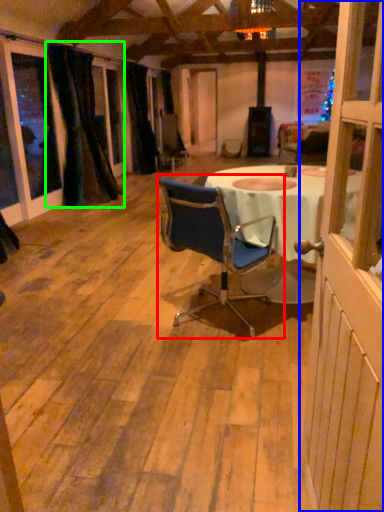
Question: Estimate the real-world distances between objects in this image. Which object is closer to chair (highlighted by a red box), screen door (highlighted by a blue box) or curtain (highlighted by a green box)?

Choices:
 (A) screen door
 (B) curtain

Answer: (A)